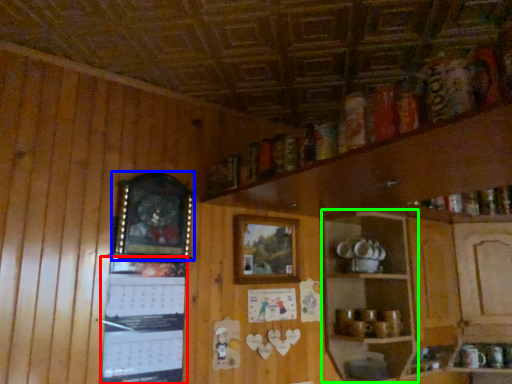
Question: Based on their relative distances, which object is farther from bulletin board (highlighted by a red box)? Choose from picture frame (highlighted by a blue box) and shelf (highlighted by a green box).

Choices:
 (A) picture frame
 (B) shelf

Answer: (B)